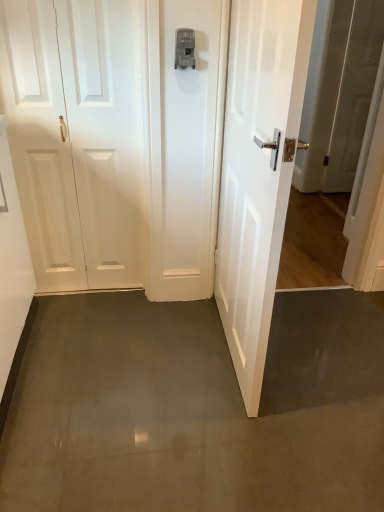
Question: Is matte gray latch at center positioned in front of white glossy door at right, the 2th door in the left-to-right sequence?

Choices:
 (A) no
 (B) yes

Answer: (A)

Question: Does matte gray latch at center have a larger size compared to white glossy door at right, which appears as the first door when viewed from the right?

Choices:
 (A) yes
 (B) no

Answer: (B)

Question: From a real-world perspective, is matte gray latch at center under white glossy door at right, which appears as the first door when viewed from the right?

Choices:
 (A) yes
 (B) no

Answer: (B)

Question: Is matte gray latch at center oriented towards white glossy door at right, the 2th door in the left-to-right sequence?

Choices:
 (A) no
 (B) yes

Answer: (A)

Question: Would you say matte gray latch at center is a long distance from white glossy door at right, the 2th door in the left-to-right sequence?

Choices:
 (A) no
 (B) yes

Answer: (A)

Question: From the image's perspective, is white glossy door at right, the 2th door in the left-to-right sequence, positioned above or below white glossy door at left, the 1th door positioned from the left?

Choices:
 (A) below
 (B) above

Answer: (A)

Question: In the image, is white glossy door at right, which appears as the first door when viewed from the right, positioned in front of or behind white glossy door at left, the second door from the right?

Choices:
 (A) behind
 (B) front

Answer: (B)

Question: Is white glossy door at right, the 2th door in the left-to-right sequence, wider or thinner than white glossy door at left, the second door from the right?

Choices:
 (A) thin
 (B) wide

Answer: (B)

Question: Considering the positions of white glossy door at right, which appears as the first door when viewed from the right, and white glossy door at left, the second door from the right, in the image, is white glossy door at right, which appears as the first door when viewed from the right, bigger or smaller than white glossy door at left, the second door from the right,?

Choices:
 (A) small
 (B) big

Answer: (B)

Question: Does point (188, 53) appear closer or farther from the camera than point (230, 23)?

Choices:
 (A) farther
 (B) closer

Answer: (A)

Question: In the image, is matte gray latch at center positioned in front of or behind white glossy door at right, the 2th door in the left-to-right sequence?

Choices:
 (A) front
 (B) behind

Answer: (B)

Question: Looking at the image, does matte gray latch at center seem bigger or smaller compared to white glossy door at right, the 2th door in the left-to-right sequence?

Choices:
 (A) small
 (B) big

Answer: (A)

Question: Is matte gray latch at center taller or shorter than white glossy door at right, which appears as the first door when viewed from the right?

Choices:
 (A) tall
 (B) short

Answer: (B)

Question: Is white glossy door at right, which appears as the first door when viewed from the right, bigger or smaller than matte gray latch at center?

Choices:
 (A) big
 (B) small

Answer: (A)

Question: Is white glossy door at right, the 2th door in the left-to-right sequence, inside or outside of matte gray latch at center?

Choices:
 (A) inside
 (B) outside

Answer: (B)